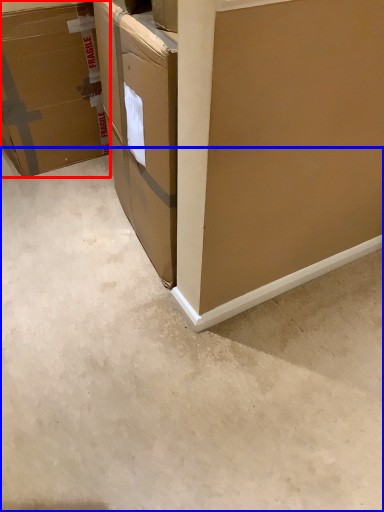
Question: Which point is further to the camera, box (highlighted by a red box) or concrete (highlighted by a blue box)?

Choices:
 (A) box
 (B) concrete

Answer: (A)